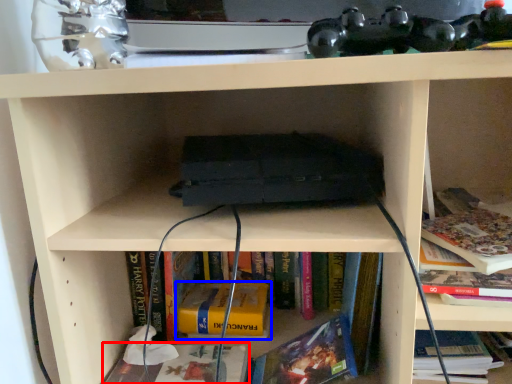
Question: Which object appears farthest to the camera in this image, book (highlighted by a red box) or book (highlighted by a blue box)?

Choices:
 (A) book
 (B) book

Answer: (B)